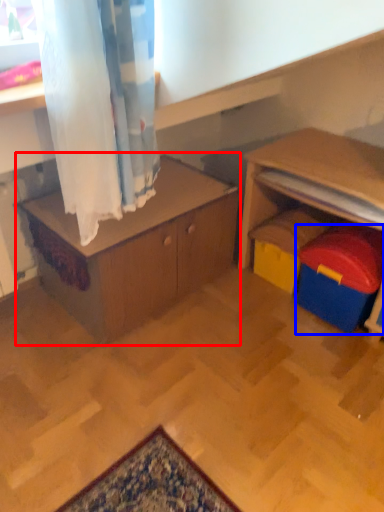
Question: Among these objects, which one is farthest to the camera, table (highlighted by a red box) or toy (highlighted by a blue box)?

Choices:
 (A) table
 (B) toy

Answer: (B)